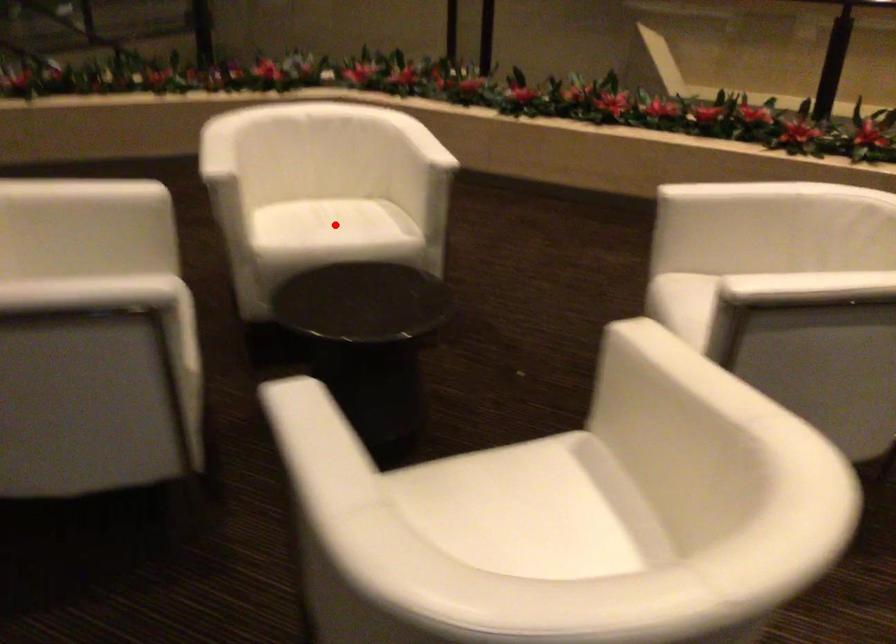
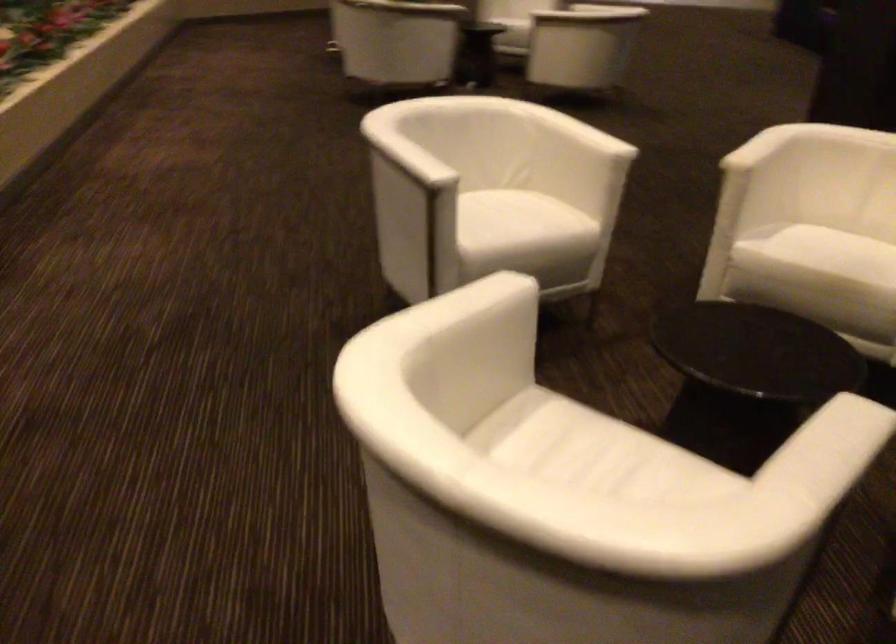
Question: I am providing you with two images of the same scene from different viewpoints. A red point is marked on the first image. Is the red point's position out of view in image 2?

Choices:
 (A) Yes
 (B) No

Answer: (B)